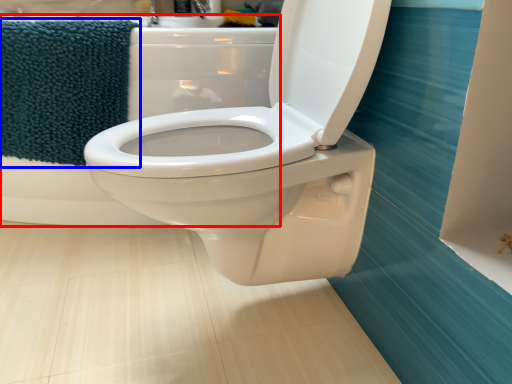
Question: Which object appears farthest to the camera in this image, bath (highlighted by a red box) or beach towel (highlighted by a blue box)?

Choices:
 (A) bath
 (B) beach towel

Answer: (B)